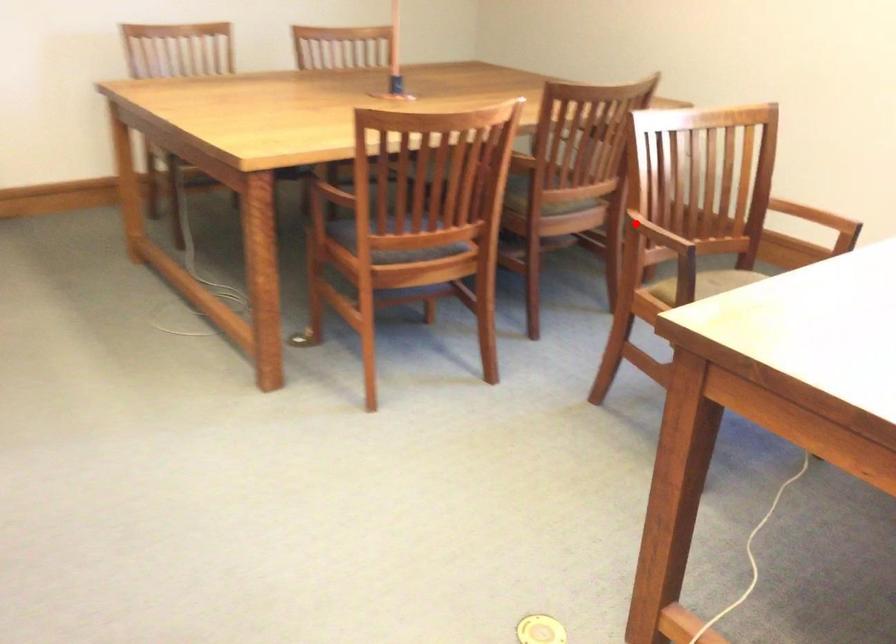
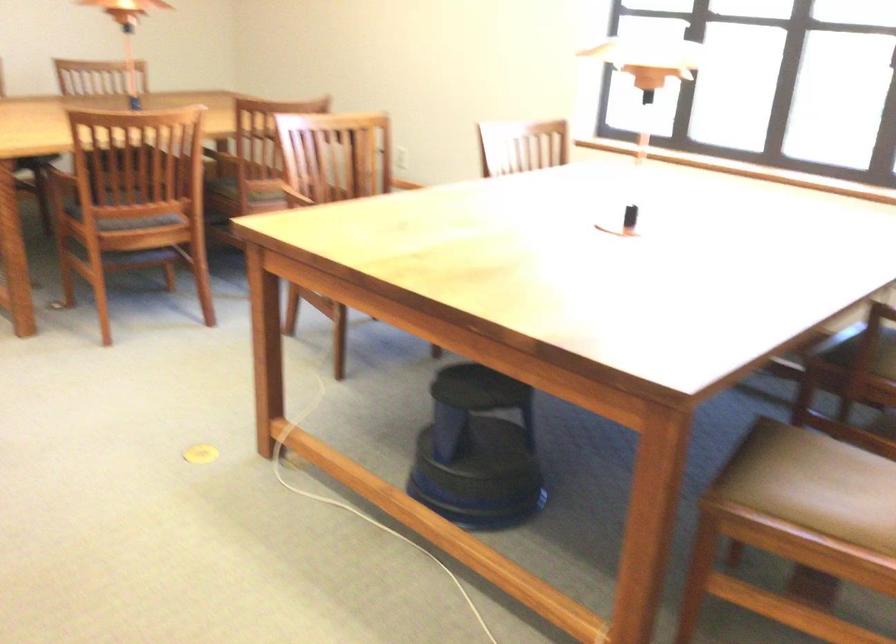
Where in the second image is the point corresponding to the highlighted location from the first image?

(303, 194)